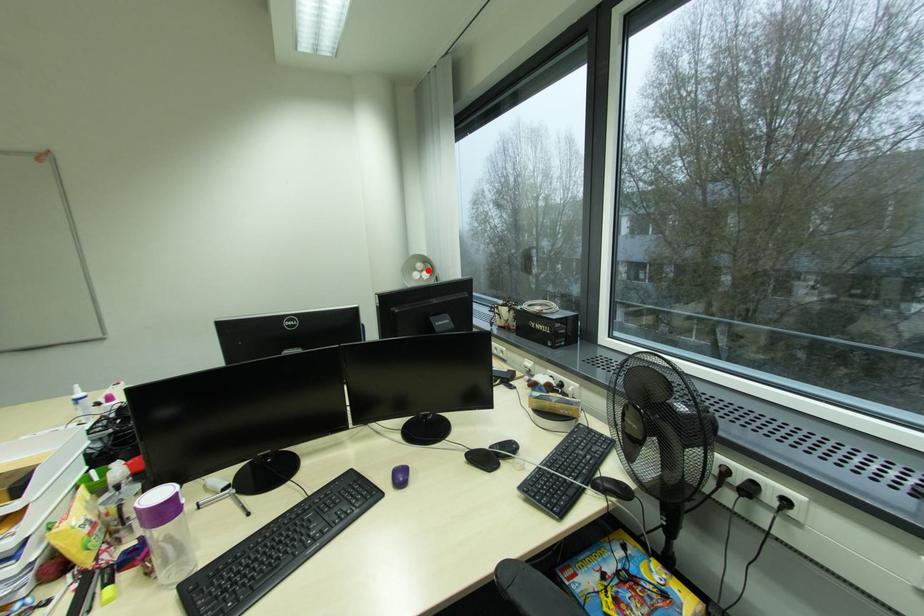
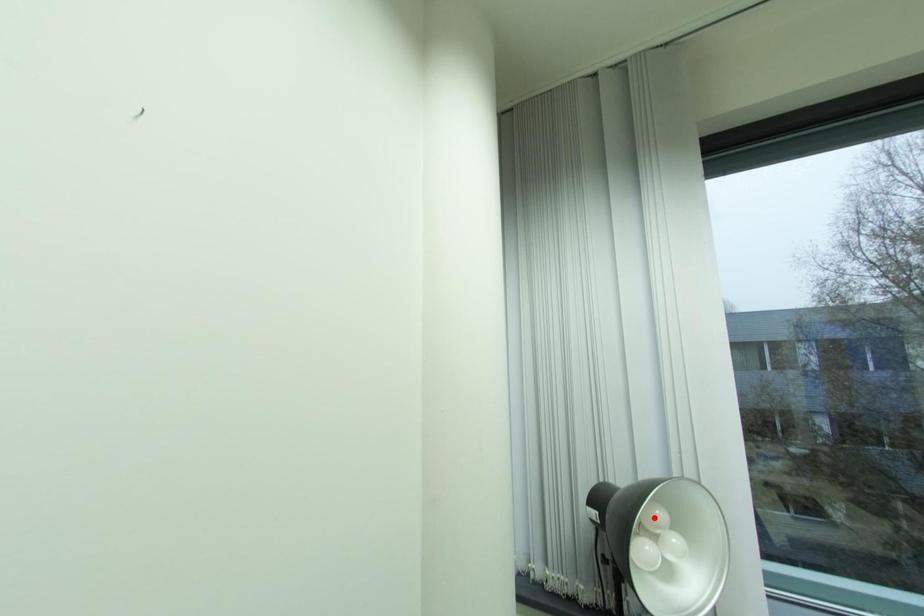
In the scene shown: I am providing you with two images of the same scene from different viewpoints. A red point is marked on the first image and another point is marked on the second image. Is the red point in image1 aligned with the point shown in image2?

No